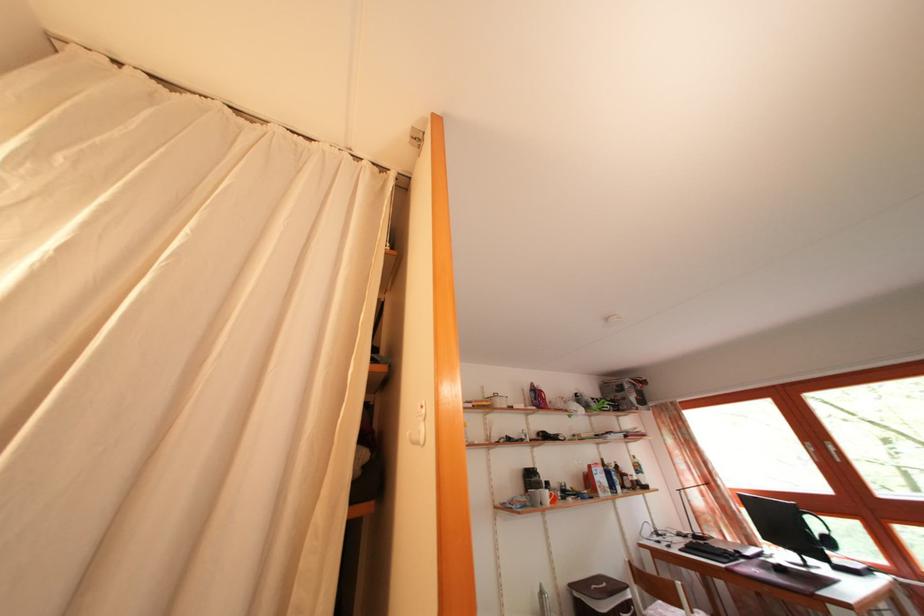
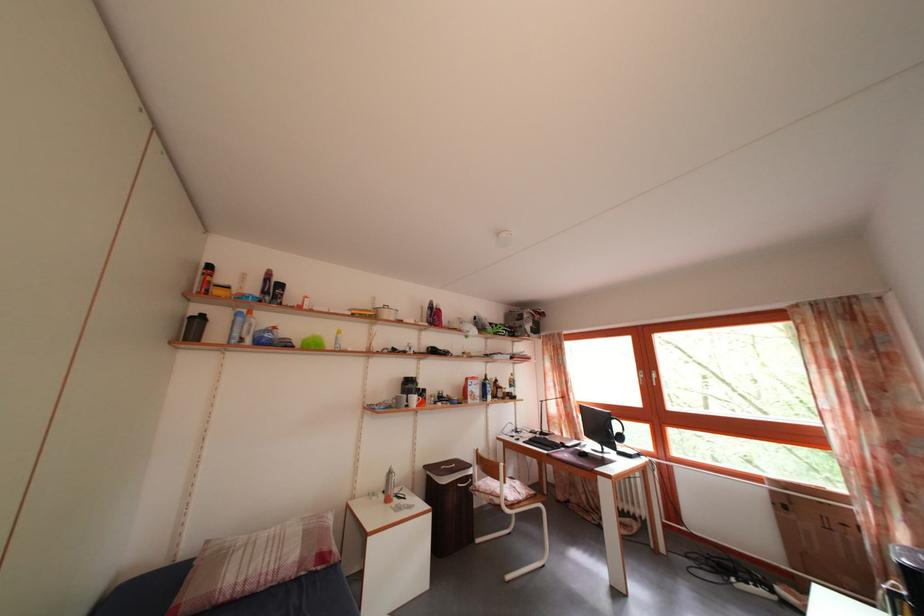
The point at (488, 405) is marked in the first image. Where is the corresponding point in the second image?

(377, 315)